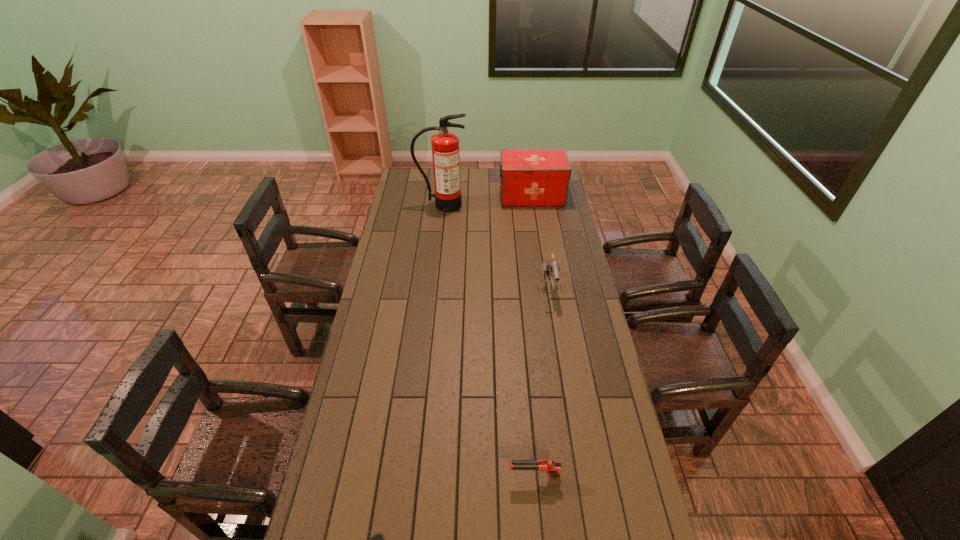
Locate an element on the screen. free space located at the barrel end of the farther gun is located at coordinates (552, 321).

I want to click on vacant space situated 0.400m at the aiming end of the fourth farthest object, so click(372, 476).

Find the location of `vacant space located 0.080m at the aiming end of the fourth farthest object`. vacant space located 0.080m at the aiming end of the fourth farthest object is located at coordinates (482, 476).

Image resolution: width=960 pixels, height=540 pixels. Find the location of `free location located 0.330m at the aiming end of the fourth farthest object`. free location located 0.330m at the aiming end of the fourth farthest object is located at coordinates (396, 476).

Where is `object at the far edge`? This screenshot has width=960, height=540. object at the far edge is located at coordinates (528, 177).

Where is `object that is positioned at the left edge`? This screenshot has width=960, height=540. object that is positioned at the left edge is located at coordinates 445,145.

Image resolution: width=960 pixels, height=540 pixels. Find the location of `the first-aid kit present at the right edge`. the first-aid kit present at the right edge is located at coordinates coord(528,177).

I want to click on gun present at the right edge, so 551,266.

The width and height of the screenshot is (960, 540). I want to click on object present at the far right corner, so click(528, 177).

The width and height of the screenshot is (960, 540). Identify the location of free space at the far edge of the desktop. (487, 172).